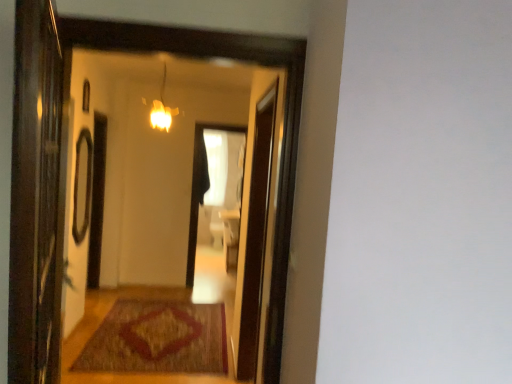
Image resolution: width=512 pixels, height=384 pixels. What do you see at coordinates (158, 339) in the screenshot? I see `brown woven mat at center` at bounding box center [158, 339].

Identify the location of transparent glass screen door at center, which appears as the 2th screen door when viewed from the front. (254, 232).

The width and height of the screenshot is (512, 384). What do you see at coordinates (162, 108) in the screenshot? I see `matte glass light fixture at upper center` at bounding box center [162, 108].

The height and width of the screenshot is (384, 512). Identify the location of brown woven mat at center. (158, 339).

Is point (212, 81) less distant than point (27, 179)?

No, (212, 81) is further to viewer.

Would you say matte wooden mirror at center is a long distance from transparent glass screen door at left, placed as the 2th screen door when sorted from back to front?

Yes, matte wooden mirror at center and transparent glass screen door at left, placed as the 2th screen door when sorted from back to front, are located far from each other.

From a real-world perspective, is matte wooden mirror at center on top of transparent glass screen door at left, acting as the first screen door starting from the front?

Yes, from a real-world perspective, matte wooden mirror at center is over transparent glass screen door at left, acting as the first screen door starting from the front

Considering the positions of objects matte glass light fixture at upper center and transparent glass screen door at left, which appears as the first screen door when viewed from the left, in the image provided, who is more to the right, matte glass light fixture at upper center or transparent glass screen door at left, which appears as the first screen door when viewed from the left,?

Positioned to the right is transparent glass screen door at left, which appears as the first screen door when viewed from the left.

Are matte glass light fixture at upper center and transparent glass screen door at left, acting as the first screen door starting from the front, located far from each other?

Yes, matte glass light fixture at upper center and transparent glass screen door at left, acting as the first screen door starting from the front, are located far from each other.

Can you confirm if matte glass light fixture at upper center is shorter than transparent glass screen door at left, acting as the first screen door starting from the front?

Yes, matte glass light fixture at upper center is shorter than transparent glass screen door at left, acting as the first screen door starting from the front.

In the image, is matte glass light fixture at upper center positioned in front of or behind transparent glass screen door at left, placed as the 2th screen door when sorted from back to front?

matte glass light fixture at upper center is positioned farther from the viewer than transparent glass screen door at left, placed as the 2th screen door when sorted from back to front.

Which object is positioned more to the left, transparent glass screen door at left, placed as the 2th screen door when sorted from back to front, or brown woven mat at center?

Positioned to the left is brown woven mat at center.

Does point (51, 144) appear closer or farther from the camera than point (168, 332)?

Point (51, 144).

From a real-world perspective, relative to brown woven mat at center, is transparent glass screen door at left, acting as the first screen door starting from the front, vertically above or below?

transparent glass screen door at left, acting as the first screen door starting from the front, is above brown woven mat at center.

From the picture: Is transparent glass screen door at left, which appears as the 2th screen door when viewed from the right, positioned beyond the bounds of brown woven mat at center?

transparent glass screen door at left, which appears as the 2th screen door when viewed from the right, is positioned outside brown woven mat at center.

In the scene shown: How many degrees apart are the facing directions of transparent glass screen door at left, placed as the 2th screen door when sorted from back to front, and matte glass light fixture at upper center?

87.5 degrees.

Consider the image. Considering the positions of objects transparent glass screen door at left, placed as the 2th screen door when sorted from back to front, and matte glass light fixture at upper center in the image provided, who is behind, transparent glass screen door at left, placed as the 2th screen door when sorted from back to front, or matte glass light fixture at upper center?

matte glass light fixture at upper center is behind.

Where is `screen door that is the 1st one when counting rightward from the matte glass light fixture at upper center`? The height and width of the screenshot is (384, 512). screen door that is the 1st one when counting rightward from the matte glass light fixture at upper center is located at coordinates (36, 198).

Based on the photo, does matte glass light fixture at upper center have a lesser width compared to matte wooden mirror at center?

No.

From the image's perspective, would you say matte glass light fixture at upper center is positioned over matte wooden mirror at center?

Yes, from the image's perspective, matte glass light fixture at upper center is over matte wooden mirror at center.

Who is shorter, matte glass light fixture at upper center or matte wooden mirror at center?

matte glass light fixture at upper center.

From a real-world perspective, who is located higher, matte glass light fixture at upper center or matte wooden mirror at center?

matte glass light fixture at upper center, from a real-world perspective.

From a real-world perspective, relative to matte wooden mirror at center, is matte glass window at upper left vertically above or below?

matte glass window at upper left is situated higher than matte wooden mirror at center in the real world.

Which of these two, matte glass window at upper left or matte wooden mirror at center, stands shorter?

Standing shorter between the two is matte glass window at upper left.

Is point (83, 82) positioned before point (128, 374)?

No, (83, 82) is further to viewer.

Is matte glass window at upper left at the right side of matte wooden mirror at center?

No, matte glass window at upper left is not to the right of matte wooden mirror at center.

Considering the points (239, 364) and (86, 92), which point is behind, point (239, 364) or point (86, 92)?

Point (86, 92)

Between transparent glass screen door at center, which appears as the 2th screen door when viewed from the front, and matte glass window at upper left, which one has more height?

transparent glass screen door at center, which appears as the 2th screen door when viewed from the front.

Where is `screen door that is the 2nd object directly below the matte glass window at upper left (from a real-world perspective)`? This screenshot has width=512, height=384. screen door that is the 2nd object directly below the matte glass window at upper left (from a real-world perspective) is located at coordinates (254, 232).

Where is `mirror located above the transparent glass screen door at left, acting as the first screen door starting from the front (from the image's perspective)`? Image resolution: width=512 pixels, height=384 pixels. mirror located above the transparent glass screen door at left, acting as the first screen door starting from the front (from the image's perspective) is located at coordinates (175, 214).

Where is `light fixture that appears above the transparent glass screen door at left, which appears as the 2th screen door when viewed from the right (from a real-world perspective)`? This screenshot has width=512, height=384. light fixture that appears above the transparent glass screen door at left, which appears as the 2th screen door when viewed from the right (from a real-world perspective) is located at coordinates (162, 108).

From the image, which object appears to be farther from matte glass window at upper left, matte glass light fixture at upper center or matte wooden mirror at center?

matte wooden mirror at center is positioned further to the anchor matte glass window at upper left.

When comparing their distances from matte glass light fixture at upper center, does transparent glass screen door at center, acting as the first screen door starting from the right, or matte glass window at upper left seem further?

transparent glass screen door at center, acting as the first screen door starting from the right, lies further to matte glass light fixture at upper center than the other object.

Considering their positions, is transparent glass screen door at left, acting as the first screen door starting from the front, positioned further to transparent glass screen door at center, which appears as the 1th screen door when viewed from the back, than brown woven mat at center?

transparent glass screen door at left, acting as the first screen door starting from the front, is further to transparent glass screen door at center, which appears as the 1th screen door when viewed from the back.

Estimate the real-world distances between objects in this image. Which object is closer to matte glass light fixture at upper center, transparent glass screen door at left, acting as the first screen door starting from the front, or brown woven mat at center?

brown woven mat at center is closer to matte glass light fixture at upper center.

Based on their spatial positions, is matte glass window at upper left or matte glass light fixture at upper center closer to transparent glass screen door at center, which appears as the 1th screen door when viewed from the back?

matte glass light fixture at upper center is positioned closer to the anchor transparent glass screen door at center, which appears as the 1th screen door when viewed from the back.

Estimate the real-world distances between objects in this image. Which object is further from matte wooden mirror at center, brown woven mat at center or matte glass light fixture at upper center?

The object further to matte wooden mirror at center is brown woven mat at center.

Considering their positions, is transparent glass screen door at center, marked as the 2th screen door in a left-to-right arrangement, positioned further to matte glass window at upper left than transparent glass screen door at left, placed as the 2th screen door when sorted from back to front?

The object further to matte glass window at upper left is transparent glass screen door at left, placed as the 2th screen door when sorted from back to front.

Looking at the image, which one is located closer to matte wooden mirror at center, transparent glass screen door at center, acting as the first screen door starting from the right, or transparent glass screen door at left, which appears as the first screen door when viewed from the left?

transparent glass screen door at center, acting as the first screen door starting from the right.

The width and height of the screenshot is (512, 384). Find the location of `light fixture positioned between transparent glass screen door at center, acting as the first screen door starting from the right, and matte glass window at upper left from near to far`. light fixture positioned between transparent glass screen door at center, acting as the first screen door starting from the right, and matte glass window at upper left from near to far is located at coordinates (162, 108).

Image resolution: width=512 pixels, height=384 pixels. Identify the location of light fixture that lies between matte glass window at upper left and brown woven mat at center from top to bottom. (162, 108).

Identify the location of mirror between transparent glass screen door at left, placed as the 2th screen door when sorted from back to front, and brown woven mat at center in the front-back direction. (175, 214).

You are a GUI agent. You are given a task and a screenshot of the screen. Output one action in this format:
    pyautogui.click(x=<x>, y=<y>)
    Task: Click on the screen door between matte wooden mirror at center and matte glass window at upper left from front to back
    The image size is (512, 384).
    Given the screenshot: What is the action you would take?
    pyautogui.click(x=254, y=232)